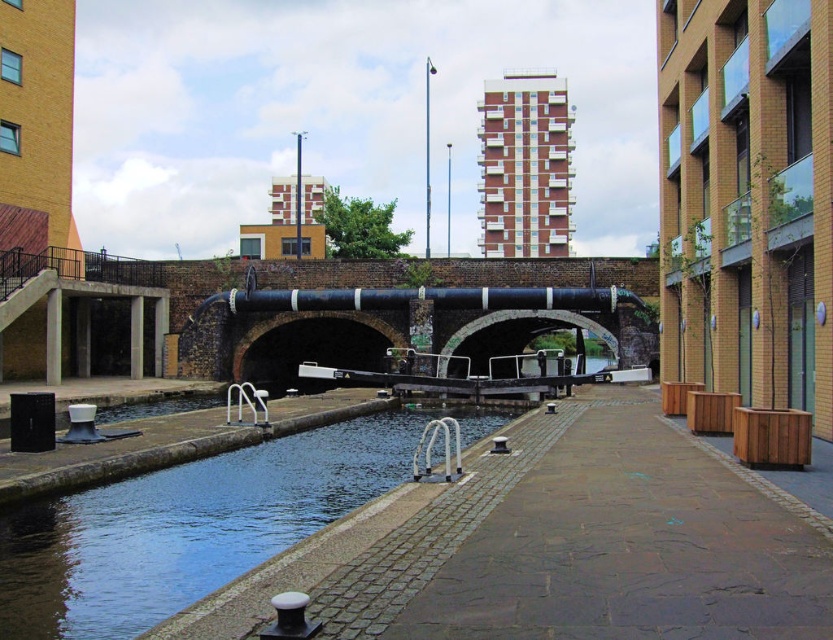
Question: Does brown stone path at center have a larger size compared to smooth concrete river at center?

Choices:
 (A) no
 (B) yes

Answer: (A)

Question: Among these objects, which one is nearest to the camera?

Choices:
 (A) brown stone path at center
 (B) black concrete bridge at center
 (C) smooth concrete river at center

Answer: (A)

Question: From the image, what is the correct spatial relationship of smooth concrete river at center in relation to black concrete bridge at center?

Choices:
 (A) left
 (B) right

Answer: (A)

Question: Which point is closer to the camera taking this photo?

Choices:
 (A) (67, 627)
 (B) (452, 346)

Answer: (A)

Question: Based on their relative distances, which object is farther from the smooth concrete river at center?

Choices:
 (A) brown stone path at center
 (B) black concrete bridge at center

Answer: (B)

Question: Does smooth concrete river at center come behind black concrete bridge at center?

Choices:
 (A) no
 (B) yes

Answer: (A)